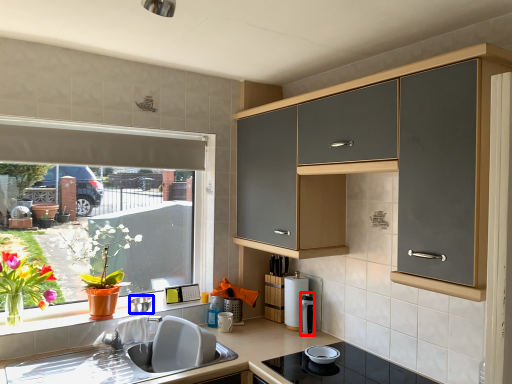
Question: Which object is further to the camera taking this photo, appliance (highlighted by a red box) or appliance (highlighted by a blue box)?

Choices:
 (A) appliance
 (B) appliance

Answer: (A)